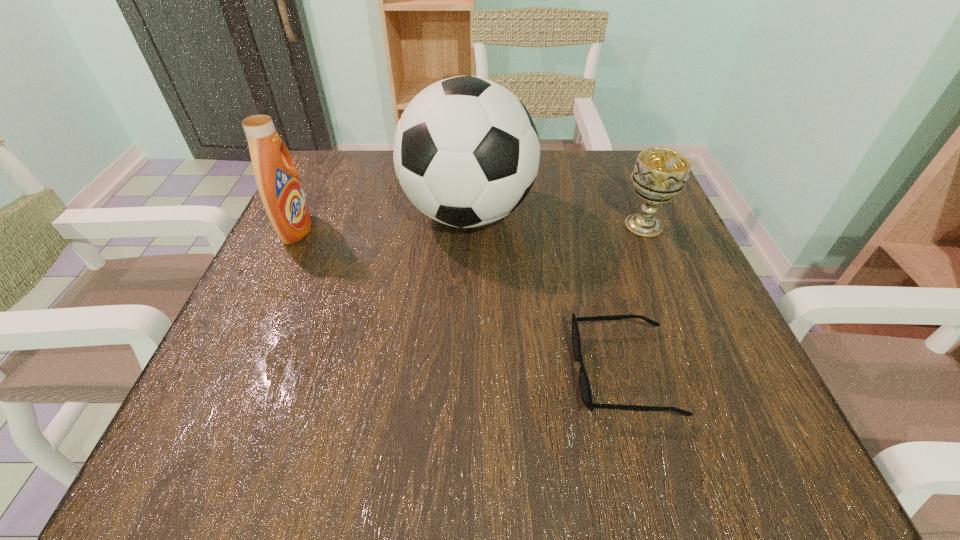
You are a GUI agent. You are given a task and a screenshot of the screen. Output one action in this format:
    pyautogui.click(x=<x>, y=<y>)
    Task: Click on the free space at the left edge
    The image size is (960, 540).
    Given the screenshot: What is the action you would take?
    pyautogui.click(x=223, y=388)

At what (x,y) coordinates should I click in order to perform the action: click on vacant region at the right edge of the desktop. Please return your answer as a coordinate pair (x, y). This screenshot has width=960, height=540. Looking at the image, I should click on (652, 319).

Find the location of a particular element. The width and height of the screenshot is (960, 540). vacant space at the far left corner of the desktop is located at coordinates (330, 166).

In the image, there is a desktop. Where is `vacant space at the near left corner`? This screenshot has width=960, height=540. vacant space at the near left corner is located at coordinates click(x=263, y=446).

You are a GUI agent. You are given a task and a screenshot of the screen. Output one action in this format:
    pyautogui.click(x=<x>, y=<y>)
    Task: Click on the vacant space at the far right corner
    
    Given the screenshot: What is the action you would take?
    pyautogui.click(x=626, y=175)

At what (x,y) coordinates should I click in order to perform the action: click on vacant space at the near right corner of the desktop. Please return your answer as a coordinate pair (x, y). The height and width of the screenshot is (540, 960). Looking at the image, I should click on (776, 450).

Where is `vacant space that is in between the third tallest object and the sunglasses`? This screenshot has height=540, width=960. vacant space that is in between the third tallest object and the sunglasses is located at coordinates (634, 299).

Where is `free space between the rightmost object and the shortest object`? The width and height of the screenshot is (960, 540). free space between the rightmost object and the shortest object is located at coordinates (634, 299).

Locate an element on the screen. free space between the nearest object and the second object from left to right is located at coordinates (546, 293).

Locate an element on the screen. The image size is (960, 540). empty space between the third object from right to left and the detergent is located at coordinates (382, 222).